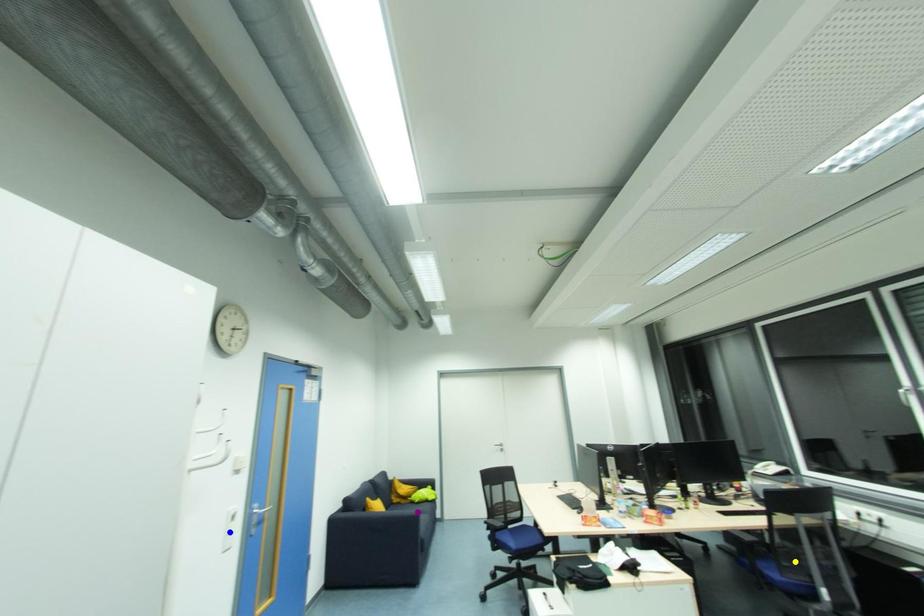
Order these from nearest to farthest:
- yellow point
- purple point
- blue point

A: blue point
yellow point
purple point